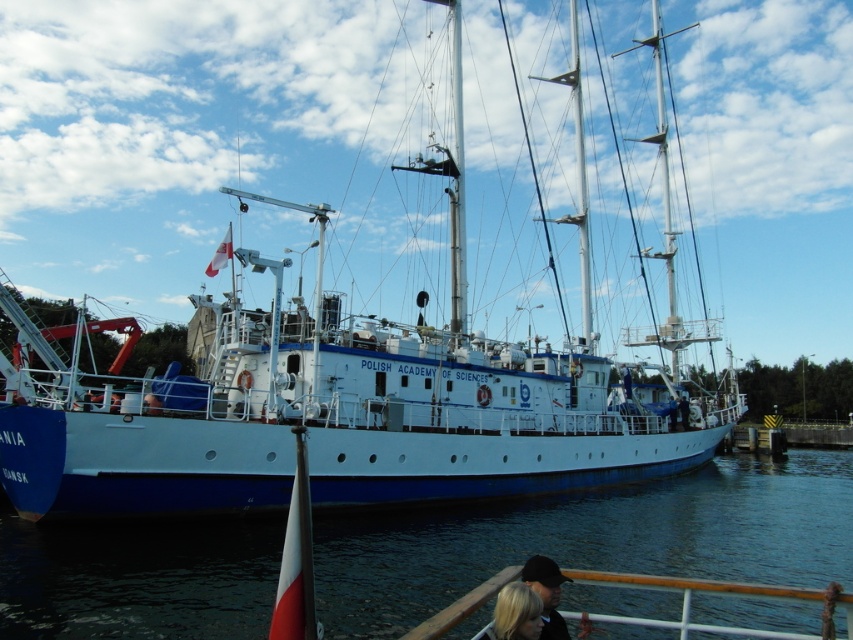
Question: In this image, where is blue water at lower left located relative to dark blue fabric cap at lower center?

Choices:
 (A) above
 (B) below

Answer: (B)

Question: Is dark blue fabric cap at lower center in front of blonde hair at lower right?

Choices:
 (A) yes
 (B) no

Answer: (B)

Question: Which object is positioned closest to the dark blue fabric cap at lower center?

Choices:
 (A) blonde hair at lower right
 (B) white matte ship at center

Answer: (A)

Question: Which point is closer to the camera taking this photo?

Choices:
 (A) (334, 628)
 (B) (363, 500)

Answer: (A)

Question: Which point is farther to the camera?

Choices:
 (A) (503, 605)
 (B) (540, 588)
 (C) (646, 520)
 (D) (39, 488)

Answer: (C)

Question: Is white matte ship at center positioned behind blonde hair at lower right?

Choices:
 (A) yes
 (B) no

Answer: (A)